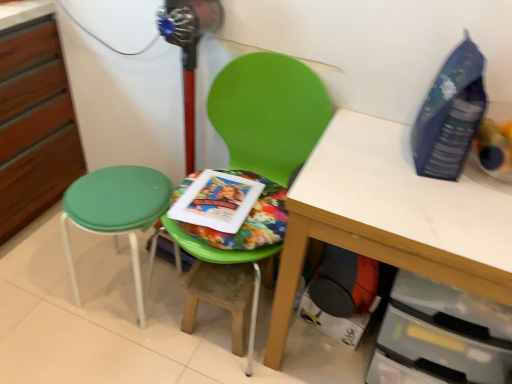
This screenshot has height=384, width=512. I want to click on free region on the left part of green plastic chair at center, so click(x=85, y=308).